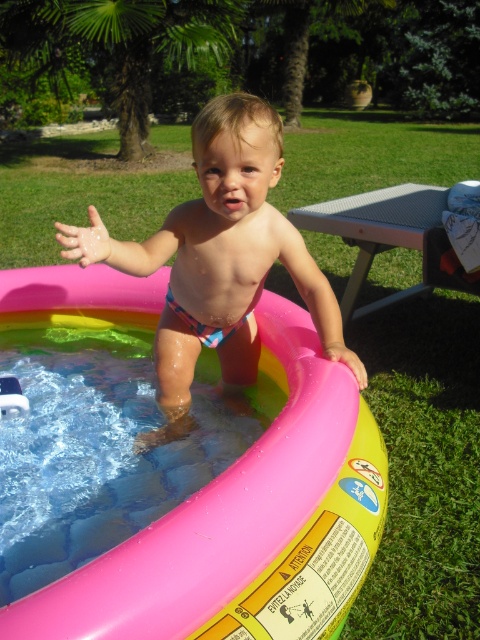
Question: Can you confirm if matte pink inflatable pool at center is thinner than gray metal picnic table at right?

Choices:
 (A) yes
 (B) no

Answer: (A)

Question: Which of these objects is positioned farthest from the matte pink inflatable pool at center?

Choices:
 (A) pink rubber tub at center
 (B) gray metal picnic table at right

Answer: (B)

Question: Which point is closer to the camera?

Choices:
 (A) matte pink inflatable pool at center
 (B) multicolored fabric shorts at center
 (C) gray metal picnic table at right

Answer: (A)

Question: Is matte pink inflatable pool at center further to camera compared to gray metal picnic table at right?

Choices:
 (A) no
 (B) yes

Answer: (A)

Question: Does pink rubber tub at center appear over multicolored fabric shorts at center?

Choices:
 (A) no
 (B) yes

Answer: (A)

Question: Considering the real-world distances, which object is farthest from the matte pink inflatable pool at center?

Choices:
 (A) gray metal picnic table at right
 (B) pink rubber tub at center
 (C) multicolored fabric shorts at center

Answer: (A)